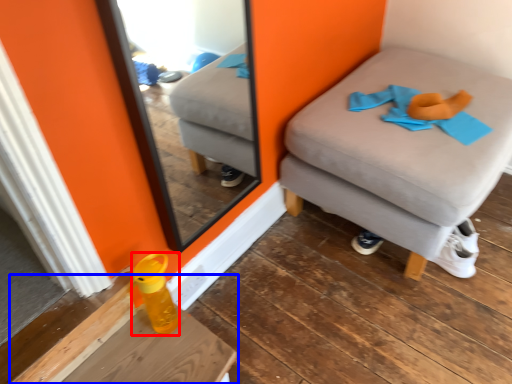
Question: Which object is closer to the camera taking this photo, bottle (highlighted by a red box) or table (highlighted by a blue box)?

Choices:
 (A) bottle
 (B) table

Answer: (B)